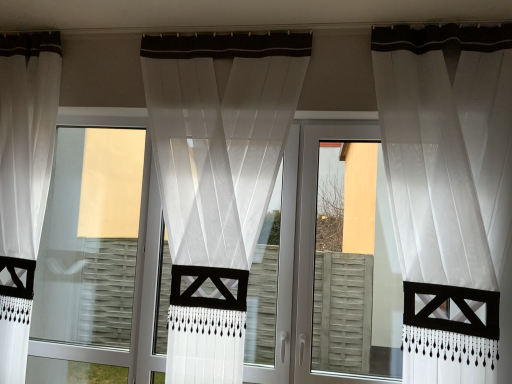
Describe the element at coordinates (24, 178) in the screenshot. The width and height of the screenshot is (512, 384). I see `white sheer curtain at left, which is the first curtain in left-to-right order` at that location.

The image size is (512, 384). Describe the element at coordinates (447, 150) in the screenshot. I see `white sheer curtain at right, which ranks as the third curtain in left-to-right order` at that location.

Find the location of `transparent fabric screen door at right`. transparent fabric screen door at right is located at coordinates (346, 261).

Between white sheer curtain at left, which is the first curtain in left-to-right order, and white sheer curtain at right, which is counted as the first curtain, starting from the right, which one appears on the right side from the viewer's perspective?

From the viewer's perspective, white sheer curtain at right, which is counted as the first curtain, starting from the right, appears more on the right side.

From the image's perspective, would you say white sheer curtain at left, which is the first curtain in left-to-right order, is shown under white sheer curtain at right, which ranks as the third curtain in left-to-right order?

No, from the image's perspective, white sheer curtain at left, which is the first curtain in left-to-right order, is not beneath white sheer curtain at right, which ranks as the third curtain in left-to-right order.

Considering the positions of points (10, 318) and (407, 94), is point (10, 318) closer to camera compared to point (407, 94)?

No, it is behind (407, 94).

Between white sheer curtain at left, arranged as the third curtain when viewed from the right, and white sheer curtain at right, which ranks as the third curtain in left-to-right order, which one has larger width?

With larger width is white sheer curtain at right, which ranks as the third curtain in left-to-right order.

Between sheer white curtain at center, acting as the second curtain starting from the left, and white sheer curtain at left, arranged as the third curtain when viewed from the right, which one appears on the right side from the viewer's perspective?

sheer white curtain at center, acting as the second curtain starting from the left.

Considering the sizes of objects sheer white curtain at center, acting as the second curtain starting from the left, and white sheer curtain at left, arranged as the third curtain when viewed from the right, in the image provided, who is bigger, sheer white curtain at center, acting as the second curtain starting from the left, or white sheer curtain at left, arranged as the third curtain when viewed from the right,?

With larger size is sheer white curtain at center, acting as the second curtain starting from the left.

From the image's perspective, is sheer white curtain at center, acting as the second curtain starting from the left, above or below white sheer curtain at left, arranged as the third curtain when viewed from the right?

Clearly, from the image's perspective, sheer white curtain at center, acting as the second curtain starting from the left, is below white sheer curtain at left, arranged as the third curtain when viewed from the right.

From a real-world perspective, starting from the white sheer curtain at left, which is the first curtain in left-to-right order, which curtain is the 1st one vertically above it? Please provide its 2D coordinates.

[(220, 137)]

Is the surface of white sheer curtain at left, which is the first curtain in left-to-right order, in direct contact with sheer white curtain at center, acting as the second curtain starting from the left?

There is a gap between white sheer curtain at left, which is the first curtain in left-to-right order, and sheer white curtain at center, acting as the second curtain starting from the left.

How many degrees apart are the facing directions of white sheer curtain at left, which is the first curtain in left-to-right order, and sheer white curtain at center, which is counted as the 2th curtain, starting from the right?

They differ by 0.00528 degrees in their facing directions.

Does white sheer curtain at left, arranged as the third curtain when viewed from the right, turn towards sheer white curtain at center, which is counted as the 2th curtain, starting from the right?

No, white sheer curtain at left, arranged as the third curtain when viewed from the right, is not facing towards sheer white curtain at center, which is counted as the 2th curtain, starting from the right.

Between white sheer curtain at left, arranged as the third curtain when viewed from the right, and sheer white curtain at center, acting as the second curtain starting from the left, which one is positioned behind?

white sheer curtain at left, arranged as the third curtain when viewed from the right, is further away from the camera.

Is white sheer curtain at right, which ranks as the third curtain in left-to-right order, turned away from transparent fabric screen door at right?

Absolutely, white sheer curtain at right, which ranks as the third curtain in left-to-right order, is directed away from transparent fabric screen door at right.

Does point (469, 215) appear closer or farther from the camera than point (322, 190)?

Clearly, point (469, 215) is closer to the camera than point (322, 190).

Between white sheer curtain at right, which is counted as the first curtain, starting from the right, and transparent fabric screen door at right, which one is positioned behind?

transparent fabric screen door at right is more distant.

From a real-world perspective, between white sheer curtain at right, which ranks as the third curtain in left-to-right order, and transparent fabric screen door at right, who is vertically lower?

transparent fabric screen door at right.

From a real-world perspective, is sheer white curtain at center, which is counted as the 2th curtain, starting from the right, positioned under transparent fabric screen door at right based on gravity?

No, from a real-world perspective, sheer white curtain at center, which is counted as the 2th curtain, starting from the right, is not beneath transparent fabric screen door at right.

Considering the sizes of objects sheer white curtain at center, acting as the second curtain starting from the left, and transparent fabric screen door at right in the image provided, who is taller, sheer white curtain at center, acting as the second curtain starting from the left, or transparent fabric screen door at right?

Standing taller between the two is sheer white curtain at center, acting as the second curtain starting from the left.

Which object is closer to the camera taking this photo, sheer white curtain at center, acting as the second curtain starting from the left, or transparent fabric screen door at right?

sheer white curtain at center, acting as the second curtain starting from the left, is more forward.

From the image's perspective, relative to transparent fabric screen door at right, is sheer white curtain at center, acting as the second curtain starting from the left, above or below?

From the image's perspective, sheer white curtain at center, acting as the second curtain starting from the left, appears above transparent fabric screen door at right.

Which of these two, transparent glass window at center or white sheer curtain at right, which is counted as the first curtain, starting from the right, is thinner?

Thinner between the two is transparent glass window at center.

Is transparent glass window at center beside white sheer curtain at right, which is counted as the first curtain, starting from the right?

transparent glass window at center and white sheer curtain at right, which is counted as the first curtain, starting from the right, are not in contact.

Can you confirm if transparent glass window at center is bigger than white sheer curtain at right, which ranks as the third curtain in left-to-right order?

No, transparent glass window at center is not bigger than white sheer curtain at right, which ranks as the third curtain in left-to-right order.

Is white sheer curtain at left, arranged as the third curtain when viewed from the right, not within transparent glass window at center?

Yes.

Looking at their sizes, would you say white sheer curtain at left, arranged as the third curtain when viewed from the right, is wider or thinner than transparent glass window at center?

Considering their sizes, white sheer curtain at left, arranged as the third curtain when viewed from the right, looks broader than transparent glass window at center.

From a real-world perspective, is white sheer curtain at left, which is the first curtain in left-to-right order, positioned above or below transparent glass window at center?

Clearly, from a real-world perspective, white sheer curtain at left, which is the first curtain in left-to-right order, is above transparent glass window at center.

Image resolution: width=512 pixels, height=384 pixels. In order to click on the 2nd curtain in front of the white sheer curtain at left, which is the first curtain in left-to-right order, starting your count from the anchor in this screenshot , I will do `click(447, 150)`.

Where is `curtain located underneath the sheer white curtain at center, acting as the second curtain starting from the left (from a real-world perspective)`? The image size is (512, 384). curtain located underneath the sheer white curtain at center, acting as the second curtain starting from the left (from a real-world perspective) is located at coordinates (24, 178).

Looking at the image, which one is located further to white sheer curtain at right, which is counted as the first curtain, starting from the right, transparent fabric screen door at right or sheer white curtain at center, acting as the second curtain starting from the left?

transparent fabric screen door at right is positioned further to the anchor white sheer curtain at right, which is counted as the first curtain, starting from the right.

Considering their positions, is transparent glass window at center positioned closer to sheer white curtain at center, acting as the second curtain starting from the left, than transparent fabric screen door at right?

transparent glass window at center is closer to sheer white curtain at center, acting as the second curtain starting from the left.

When comparing their distances from transparent fabric screen door at right, does white sheer curtain at right, which ranks as the third curtain in left-to-right order, or sheer white curtain at center, acting as the second curtain starting from the left, seem further?

sheer white curtain at center, acting as the second curtain starting from the left, is further to transparent fabric screen door at right.

Estimate the real-world distances between objects in this image. Which object is further from white sheer curtain at right, which ranks as the third curtain in left-to-right order, transparent fabric screen door at right or white sheer curtain at left, which is the first curtain in left-to-right order?

transparent fabric screen door at right is positioned further to the anchor white sheer curtain at right, which ranks as the third curtain in left-to-right order.

Estimate the real-world distances between objects in this image. Which object is closer to white sheer curtain at right, which ranks as the third curtain in left-to-right order, sheer white curtain at center, which is counted as the 2th curtain, starting from the right, or transparent fabric screen door at right?

The object closer to white sheer curtain at right, which ranks as the third curtain in left-to-right order, is sheer white curtain at center, which is counted as the 2th curtain, starting from the right.

Consider the image. Looking at the image, which one is located closer to white sheer curtain at left, which is the first curtain in left-to-right order, transparent glass window at center or transparent fabric screen door at right?

Among the two, transparent glass window at center is located nearer to white sheer curtain at left, which is the first curtain in left-to-right order.

Considering their positions, is sheer white curtain at center, acting as the second curtain starting from the left, positioned further to white sheer curtain at right, which ranks as the third curtain in left-to-right order, than white sheer curtain at left, which is the first curtain in left-to-right order?

white sheer curtain at left, which is the first curtain in left-to-right order.

Which object lies nearer to the anchor point white sheer curtain at left, arranged as the third curtain when viewed from the right, sheer white curtain at center, which is counted as the 2th curtain, starting from the right, or transparent fabric screen door at right?

Based on the image, sheer white curtain at center, which is counted as the 2th curtain, starting from the right, appears to be nearer to white sheer curtain at left, arranged as the third curtain when viewed from the right.

The width and height of the screenshot is (512, 384). Identify the location of curtain located between transparent glass window at center and transparent fabric screen door at right in the left-right direction. (220, 137).

At what (x,y) coordinates should I click in order to perform the action: click on curtain between white sheer curtain at left, arranged as the third curtain when viewed from the right, and white sheer curtain at right, which ranks as the third curtain in left-to-right order, from left to right. Please return your answer as a coordinate pair (x, y). Looking at the image, I should click on (220, 137).

Where is `window frame situated between white sheer curtain at left, arranged as the third curtain when viewed from the right, and transparent fabric screen door at right from left to right`? window frame situated between white sheer curtain at left, arranged as the third curtain when viewed from the right, and transparent fabric screen door at right from left to right is located at coordinates (90, 239).

Locate an element on the screen. This screenshot has width=512, height=384. screen door between transparent glass window at center and white sheer curtain at right, which is counted as the first curtain, starting from the right is located at coordinates (346, 261).